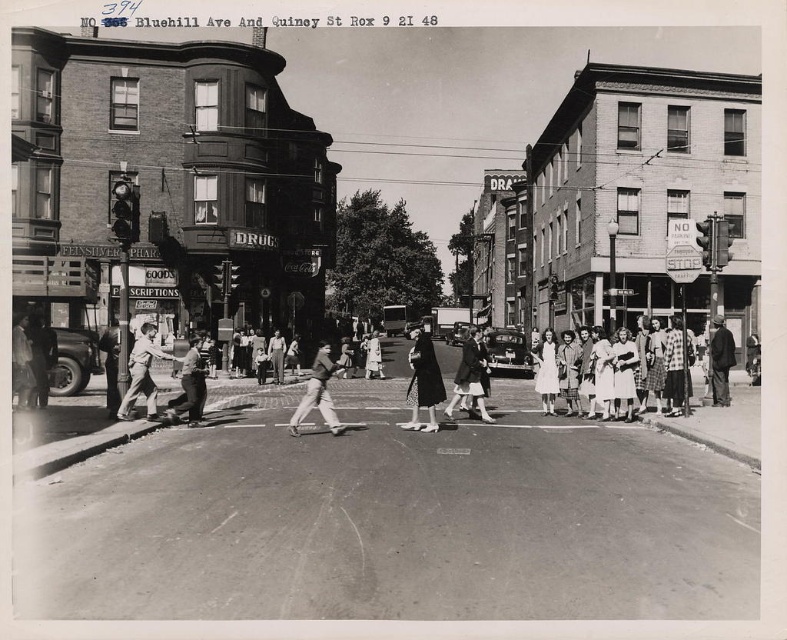
Measure the distance between matte black truck at left and shiny black car at center.

The distance of matte black truck at left from shiny black car at center is 33.94 meters.

Measure the distance between matte black truck at left and camera.

A distance of 60.61 feet exists between matte black truck at left and camera.

Is point (50, 385) less distant than point (446, 339)?

That is True.

At what (x,y) coordinates should I click in order to perform the action: click on matte black truck at left. Please return your answer as a coordinate pair (x, y). Looking at the image, I should click on (72, 360).

Does shiny silver car at center appear on the left side of dark gray suit at center?

In fact, shiny silver car at center is to the right of dark gray suit at center.

You are a GUI agent. You are given a task and a screenshot of the screen. Output one action in this format:
    pyautogui.click(x=<x>, y=<y>)
    Task: Click on the shiny silver car at center
    Image resolution: width=787 pixels, height=640 pixels.
    Given the screenshot: What is the action you would take?
    pyautogui.click(x=507, y=352)

Identify the location of shiny silver car at center. (507, 352).

Looking at this image, does matte black dress at center come behind matte black truck at left?

No, matte black dress at center is in front of matte black truck at left.

Is point (409, 368) farther from viewer compared to point (72, 385)?

Yes, point (409, 368) is farther from viewer.

The width and height of the screenshot is (787, 640). I want to click on matte black dress at center, so click(x=423, y=384).